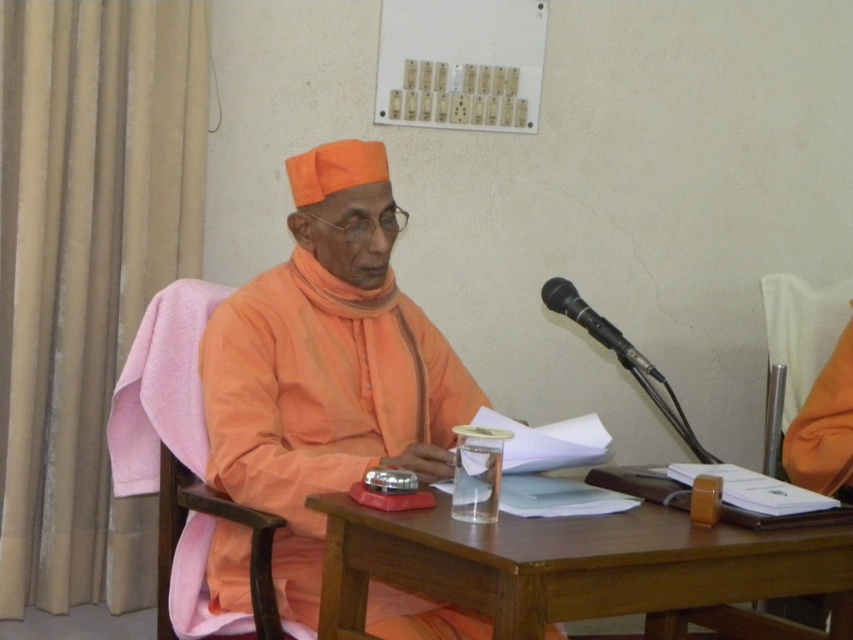
You are standing at the center of the room and want to reach both the point at (445, 561) and the point at (616, 336). Which point should you go to first to minimize the total distance traveled?

You should go to point (445, 561) first because it is closer to you than point (616, 336), so going to it first minimizes the total distance traveled.